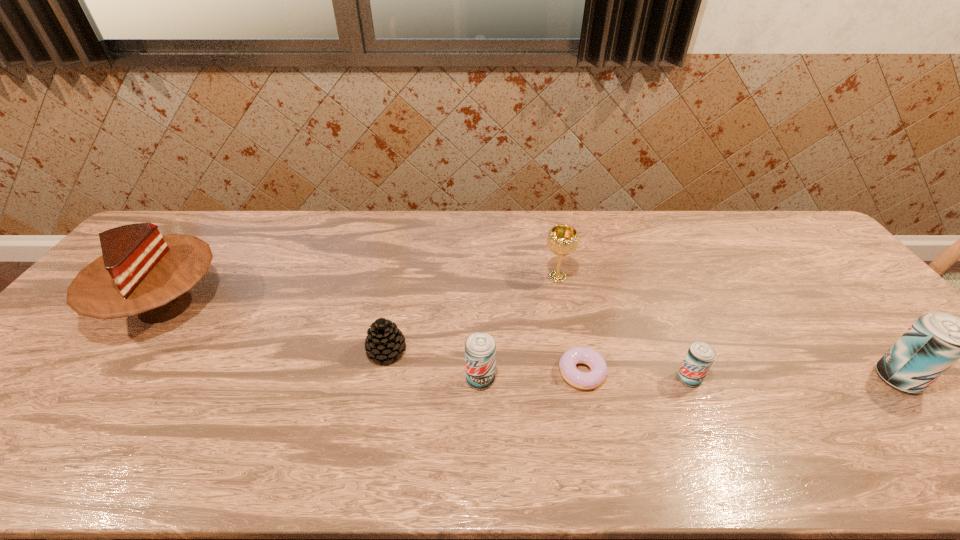
With all beer cans evenly spaced, where should an extra beer can be placed on the left to continue the pattern? Please point out a vacant space. Please provide its 2D coordinates. Your answer should be formatted as a tuple, i.e. [(x, y)], where the tuple contains the x and y coordinates of a point satisfying the conditions above.

[(272, 379)]